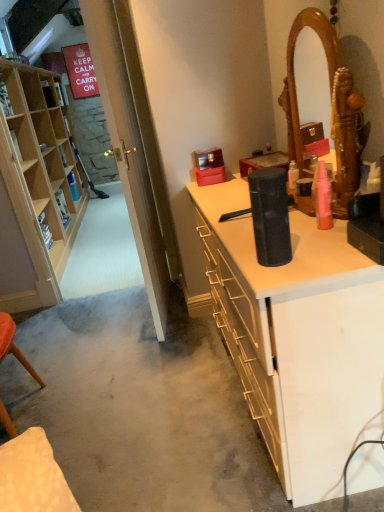
Find the location of a particular element. black matte speaker at center is located at coordinates (298, 338).

In order to face light wood cabinet at left, should I rotate leftwards or rightwards?

You should rotate left by 18.918 degrees.

What are the coordinates of `black matte speaker at center` in the screenshot? It's located at (270, 216).

Identify the location of pink matte spray can at upper right. Image resolution: width=384 pixels, height=512 pixels. point(323,198).

The image size is (384, 512). Describe the element at coordinates (134, 149) in the screenshot. I see `transparent glass door at left` at that location.

Find the location of `black matte speaker at center`. black matte speaker at center is located at coordinates (298, 338).

Between transparent glass door at left and black matte speaker at center, which one has smaller width?

black matte speaker at center is thinner.

From the image's perspective, is transparent glass door at left on black matte speaker at center?

Yes, from the image's perspective, transparent glass door at left is over black matte speaker at center.

Consider the image. Is transparent glass door at left not within black matte speaker at center?

That's correct, transparent glass door at left is outside of black matte speaker at center.

Looking at this image, how many degrees apart are the facing directions of transparent glass door at left and black matte speaker at center?

The angle between the facing direction of transparent glass door at left and the facing direction of black matte speaker at center is 6.38 degrees.

How much distance is there between transparent glass door at left and black matte speaker at center?

transparent glass door at left is 33.05 inches from black matte speaker at center.

Who is smaller, transparent glass door at left or black matte speaker at center?

Smaller between the two is transparent glass door at left.

Is black matte speaker at center located within transparent glass door at left?

No, black matte speaker at center is not inside transparent glass door at left.

In order to click on toiletry behind the black matte speaker at center in this screenshot , I will do `click(323, 198)`.

Is point (319, 204) closer or farther from the camera than point (267, 211)?

Point (319, 204) is positioned farther from the camera compared to point (267, 211).

Consider the image. Is pink matte spray can at upper right far from black matte speaker at center?

pink matte spray can at upper right is near black matte speaker at center, not far away.

What's the angular difference between pink matte spray can at upper right and black matte speaker at center's facing directions?

The angle between the facing direction of pink matte spray can at upper right and the facing direction of black matte speaker at center is 90 degrees.

Based on the photo, in the image, is black matte speaker at center positioned in front of or behind pink matte spray can at upper right?

Visually, black matte speaker at center is located in front of pink matte spray can at upper right.

From the image's perspective, is black matte speaker at center positioned above or below pink matte spray can at upper right?

Clearly, from the image's perspective, black matte speaker at center is below pink matte spray can at upper right.

Is black matte speaker at center inside the boundaries of pink matte spray can at upper right, or outside?

black matte speaker at center is outside pink matte spray can at upper right.

Is black matte speaker at center oriented away from pink matte spray can at upper right?

No, black matte speaker at center's orientation is not away from pink matte spray can at upper right.

I want to click on cabinetry on the left of the pink matte spray can at upper right, so click(40, 165).

Considering the sizes of objects light wood cabinet at left and pink matte spray can at upper right in the image provided, who is taller, light wood cabinet at left or pink matte spray can at upper right?

light wood cabinet at left.

Is light wood cabinet at left thinner than pink matte spray can at upper right?

In fact, light wood cabinet at left might be wider than pink matte spray can at upper right.

From a real-world perspective, is light wood cabinet at left below pink matte spray can at upper right?

Correct, in the physical world, light wood cabinet at left is lower than pink matte spray can at upper right.

Considering the relative sizes of black matte speaker at center and light wood cabinet at left in the image provided, is black matte speaker at center wider than light wood cabinet at left?

In fact, black matte speaker at center might be narrower than light wood cabinet at left.

Would you say black matte speaker at center is a long distance from light wood cabinet at left?

Indeed, black matte speaker at center is not near light wood cabinet at left.

Which is closer, (x=284, y=239) or (x=37, y=203)?

Point (x=284, y=239) appears to be closer to the viewer than point (x=37, y=203).

How much distance is there between black matte speaker at center and light wood cabinet at left?

black matte speaker at center is 2.65 meters away from light wood cabinet at left.

From the picture: From a real-world perspective, does black matte speaker at center stand above pink matte spray can at upper right?

No, from a real-world perspective, black matte speaker at center is not above pink matte spray can at upper right.

Which of these two, black matte speaker at center or pink matte spray can at upper right, is thinner?

pink matte spray can at upper right.

Is black matte speaker at center positioned in front of pink matte spray can at upper right?

Yes, black matte speaker at center is in front of pink matte spray can at upper right.

At what (x,y) coordinates should I click in order to perform the action: click on toiletry above the black matte speaker at center (from a real-world perspective). Please return your answer as a coordinate pair (x, y). Looking at the image, I should click on (323, 198).

Find the location of a particular element. This screenshot has width=384, height=512. glass door behind the black matte speaker at center is located at coordinates (134, 149).

Identify the location of desk on the right of the transparent glass door at left. Image resolution: width=384 pixels, height=512 pixels. point(298,338).

Looking at the image, which one is located closer to transparent glass door at left, pink matte spray can at upper right or light wood cabinet at left?

The object closer to transparent glass door at left is pink matte spray can at upper right.

From the image, which object appears to be nearer to black matte speaker at center, pink matte spray can at upper right or transparent glass door at left?

pink matte spray can at upper right is closer to black matte speaker at center.

When comparing their distances from pink matte spray can at upper right, does transparent glass door at left or light wood cabinet at left seem further?

light wood cabinet at left lies further to pink matte spray can at upper right than the other object.

In the scene shown: Which object lies further to the anchor point black matte speaker at center, black matte speaker at center or transparent glass door at left?

Among the two, transparent glass door at left is located further to black matte speaker at center.

From the image, which object appears to be farther from black matte speaker at center, pink matte spray can at upper right or black matte speaker at center?

black matte speaker at center lies further to black matte speaker at center than the other object.

Based on their spatial positions, is black matte speaker at center or light wood cabinet at left closer to transparent glass door at left?

Based on the image, black matte speaker at center appears to be nearer to transparent glass door at left.

Looking at the image, which one is located closer to light wood cabinet at left, pink matte spray can at upper right or black matte speaker at center?

black matte speaker at center is closer to light wood cabinet at left.

From the image, which object appears to be farther from light wood cabinet at left, black matte speaker at center or black matte speaker at center?

black matte speaker at center is further to light wood cabinet at left.

What are the coordinates of `appliance between transparent glass door at left and pink matte spray can at upper right in the horizontal direction` in the screenshot? It's located at (270, 216).

The image size is (384, 512). I want to click on desk between light wood cabinet at left and pink matte spray can at upper right from left to right, so click(298, 338).

This screenshot has height=512, width=384. Find the location of `appliance situated between light wood cabinet at left and pink matte spray can at upper right from left to right`. appliance situated between light wood cabinet at left and pink matte spray can at upper right from left to right is located at coordinates (270, 216).

Where is `glass door between light wood cabinet at left and black matte speaker at center`? The height and width of the screenshot is (512, 384). glass door between light wood cabinet at left and black matte speaker at center is located at coordinates (134, 149).